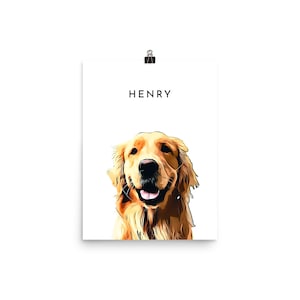
Where is `binder clip slightly blurry`? The width and height of the screenshot is (300, 300). binder clip slightly blurry is located at coordinates (280, 58), (149, 56).